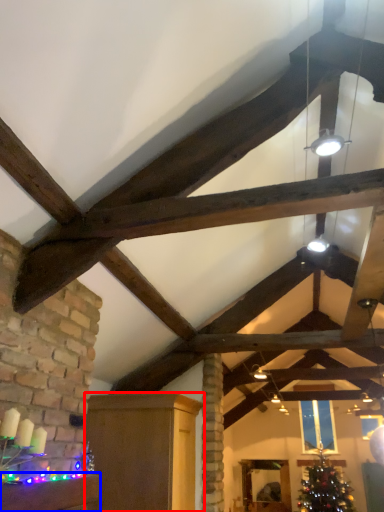
Question: Among these objects, which one is nearest to the camera, furniture (highlighted by a red box) or furniture (highlighted by a blue box)?

Choices:
 (A) furniture
 (B) furniture

Answer: (B)